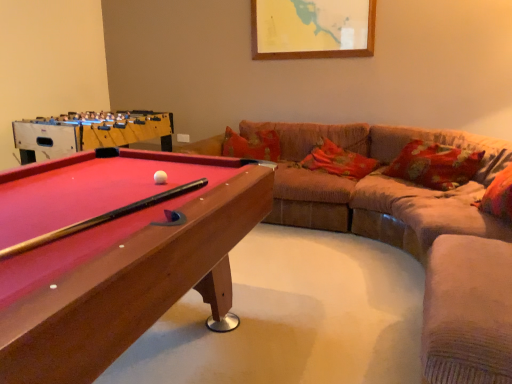
Question: Can you confirm if floral fabric pillow at center, the third pillow in the front-to-back sequence, is smaller than suede-like beige swivel chair at lower right?

Choices:
 (A) yes
 (B) no

Answer: (A)

Question: Is floral fabric pillow at center, the third pillow in the front-to-back sequence, oriented towards suede-like beige swivel chair at lower right?

Choices:
 (A) no
 (B) yes

Answer: (B)

Question: From the image's perspective, is floral fabric pillow at center, the third pillow in the front-to-back sequence, below suede-like beige swivel chair at lower right?

Choices:
 (A) no
 (B) yes

Answer: (A)

Question: Is floral fabric pillow at center, the 1th pillow from the back, outside suede-like beige swivel chair at lower right?

Choices:
 (A) yes
 (B) no

Answer: (A)

Question: Is the depth of floral fabric pillow at center, the third pillow in the front-to-back sequence, greater than that of suede-like beige swivel chair at lower right?

Choices:
 (A) yes
 (B) no

Answer: (A)

Question: From a real-world perspective, is floral fabric pillow at center, the 1th pillow from the back, positioned under suede-like beige swivel chair at lower right based on gravity?

Choices:
 (A) yes
 (B) no

Answer: (B)

Question: Can you confirm if wooden billiard table at left is wider than suede-like beige swivel chair at lower right?

Choices:
 (A) no
 (B) yes

Answer: (B)

Question: Can you see wooden billiard table at left touching suede-like beige swivel chair at lower right?

Choices:
 (A) no
 (B) yes

Answer: (A)

Question: From the image's perspective, does wooden billiard table at left appear lower than suede-like beige swivel chair at lower right?

Choices:
 (A) no
 (B) yes

Answer: (A)

Question: Does wooden billiard table at left have a lesser height compared to suede-like beige swivel chair at lower right?

Choices:
 (A) no
 (B) yes

Answer: (A)

Question: Is wooden billiard table at left to the right of suede-like beige swivel chair at lower right from the viewer's perspective?

Choices:
 (A) yes
 (B) no

Answer: (B)

Question: Can you confirm if wooden billiard table at left is bigger than suede-like beige swivel chair at lower right?

Choices:
 (A) yes
 (B) no

Answer: (A)

Question: Is suede-like beige swivel chair at lower right not close to velvet beige couch at right?

Choices:
 (A) yes
 (B) no

Answer: (B)